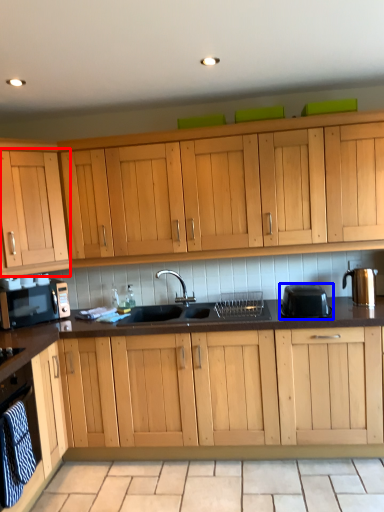
Question: Among these objects, which one is nearest to the camera, cabinetry (highlighted by a red box) or kitchen appliance (highlighted by a blue box)?

Choices:
 (A) cabinetry
 (B) kitchen appliance

Answer: (B)